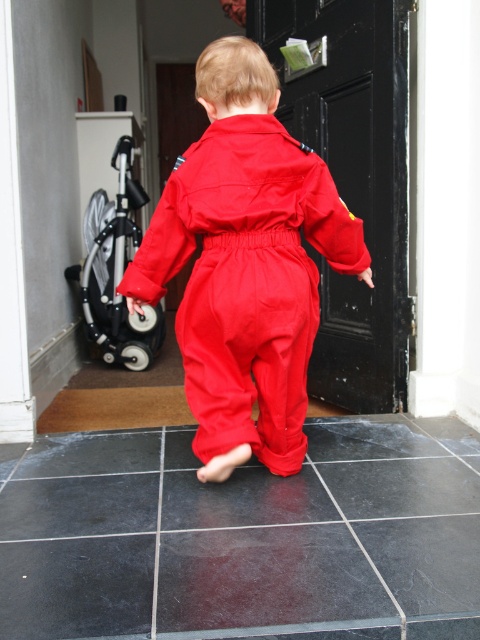
Is matte red jumpsuit at center closer to camera compared to black wooden door at center?

Yes, it is in front of black wooden door at center.

Is matte red jumpsuit at center smaller than black wooden door at center?

Indeed, matte red jumpsuit at center has a smaller size compared to black wooden door at center.

Between point (245, 384) and point (368, 152), which one is positioned in front?

Point (245, 384) is in front.

Image resolution: width=480 pixels, height=640 pixels. Find the location of `matte red jumpsuit at center`. matte red jumpsuit at center is located at coordinates (245, 262).

Looking at this image, how much distance is there between matte red jumpsuit at center and silver metallic stroller at left?

A distance of 1.75 meters exists between matte red jumpsuit at center and silver metallic stroller at left.

Which of these two, matte red jumpsuit at center or silver metallic stroller at left, stands shorter?

matte red jumpsuit at center is shorter.

Who is more distant from viewer, (231, 86) or (143, 339)?

The point (143, 339) is behind.

Where is `matte red jumpsuit at center`? matte red jumpsuit at center is located at coordinates (245, 262).

Can you confirm if black wooden door at center is positioned to the left of silver metallic stroller at left?

No, black wooden door at center is not to the left of silver metallic stroller at left.

Which is below, black wooden door at center or silver metallic stroller at left?

silver metallic stroller at left is below.

Which is in front, point (372, 186) or point (91, 275)?

Point (372, 186) is in front.

The image size is (480, 640). Identify the location of black wooden door at center. (354, 180).